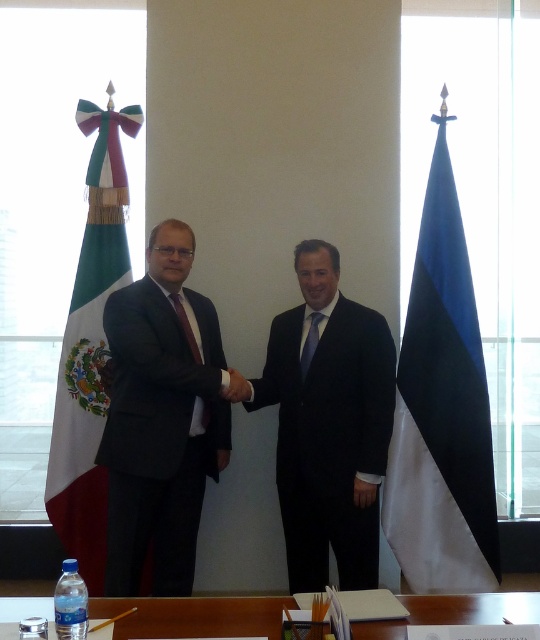
Question: Among these objects, which one is nearest to the camera?

Choices:
 (A) blue silk tie at center
 (B) black suit at center

Answer: (B)

Question: Does clear plastic bottle at lower center have a lesser width compared to blue silk tie at center?

Choices:
 (A) yes
 (B) no

Answer: (B)

Question: Estimate the real-world distances between objects in this image. Which object is closer to the blue fabric flag at right?

Choices:
 (A) matte black hand at center
 (B) dark red silk tie at center

Answer: (A)

Question: Can you confirm if clear plastic bottle at lower center is positioned to the right of dark red silk tie at center?

Choices:
 (A) yes
 (B) no

Answer: (B)

Question: Is matte black suit at center above black suit at center?

Choices:
 (A) no
 (B) yes

Answer: (B)

Question: Which point is closer to the camera taking this photo?

Choices:
 (A) (65, 324)
 (B) (375, 401)
 (C) (233, 372)

Answer: (C)